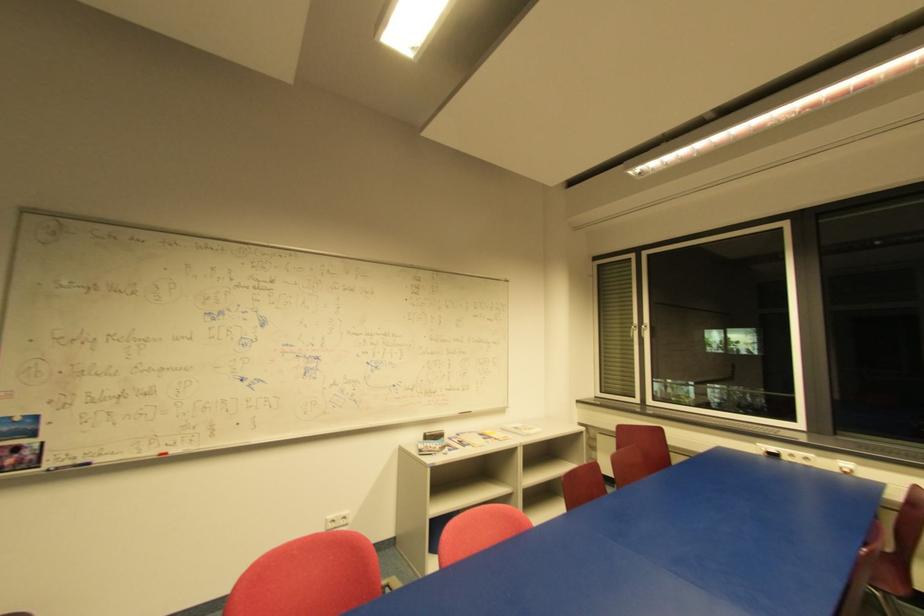
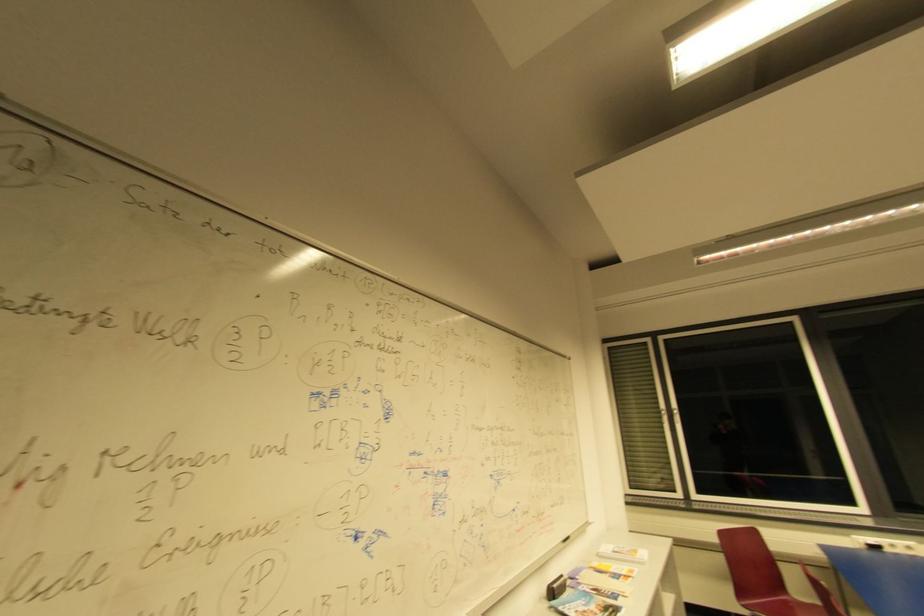
Find the pixel in the second image that matches (533,431) in the first image.

(640, 553)